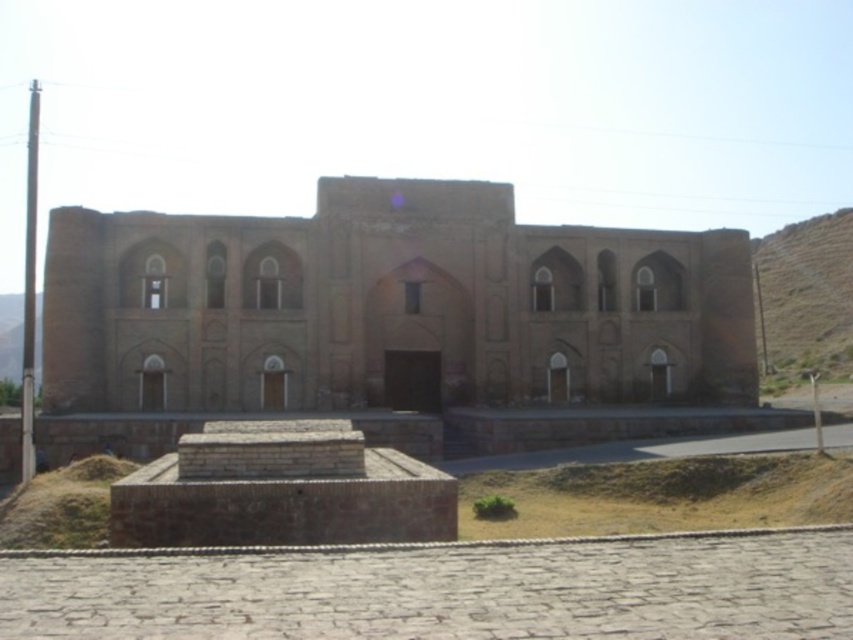
You are standing in front of the historical building and want to walk towards the brown grass at lower left. Which direction should you turn to avoid the brown rocky hill at right?

You should turn to the left to avoid the brown rocky hill at right, as the brown rocky hill at right is located to the right of the brown grass at lower left, meaning the grass is to your left side.

You are standing in front of the historical building and want to cross to the other side. You notice a brown rocky hill at right and brown grass at lower left. Which path would allow you to move further horizontally before needing to change direction?

The brown rocky hill at right has a greater width than the brown grass at lower left, so moving along the brown rocky hill at right would allow you to go further horizontally before needing to change direction.

You are standing in front of the historical building and want to reach the brown rocky hill at right. Which direction should you walk to get there?

You should walk to the right to reach the brown rocky hill at right since it is located at the right side of the scene.